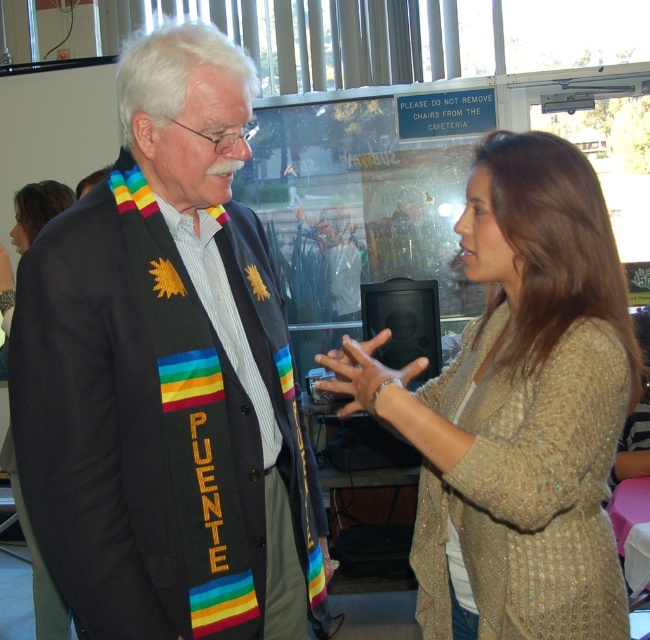
You are an event planner arranging decorations for a formal event. You need to place a 1.2 meter tall floral arrangement between the matte black suit at center and the shiny gold necklace at upper left. Will the floral arrangement fit vertically between them?

The matte black suit at center is taller than the shiny gold necklace at upper left. Since the floral arrangement is 1.2 meters tall, it depends on the height of the taller object. However, without specific height measurements, we cannot confirm if it will fit. Please provide the exact height of the matte black suit at center.

You are standing at the origin point in the image. Which of the two points, point [148,275] or point [424,557], is closer to you?

Point [148,275] is closer to you because it is in front of point [424,557].

You are standing in the room where the matte black suit at center and the sparkly beige cardigan at center are located. From your perspective, which object is positioned to the left?

The matte black suit at center is to the left of the sparkly beige cardigan at center, so the matte black suit at center is positioned to the left.